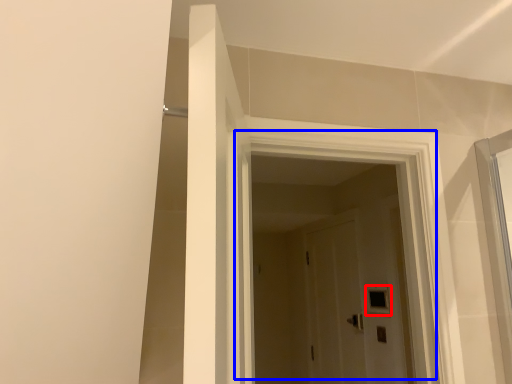
Question: Among these objects, which one is farthest to the camera, window (highlighted by a red box) or door (highlighted by a blue box)?

Choices:
 (A) window
 (B) door

Answer: (A)